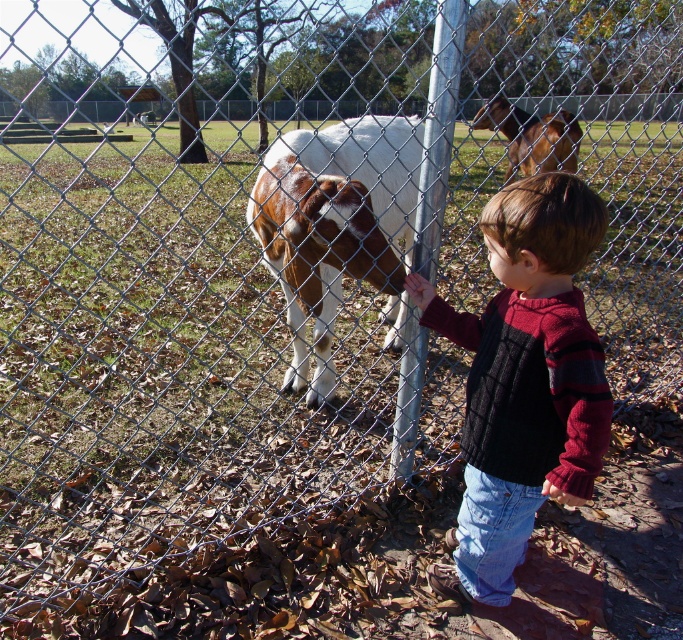
You are a photographer trying to capture the calf in the center. The camera you are using has a focus point at position (337, 227). Based on the scene, what is the camera focusing on?

A: The point (337, 227) is on the brown and white fur at center, so the camera is focusing on the calf.

You are a photographer trying to capture a clear shot of both the knitted sweater at center and the brown and white fur at center. Based on their positions, which object should you focus on first to ensure both are in focus?

The knitted sweater at center is below brown and white fur at center, so you should focus on the brown and white fur at center first to ensure both are in focus.

You are a photographer trying to capture a clear shot of the brown glossy horse at upper center. However, the knitted sweater at center is blocking your view. Can you determine if the horse is visible from your current position?

The knitted sweater at center is in front of the brown glossy horse at upper center, so the horse is partially or fully blocked from view. Move to a position where the sweater is no longer between you and the horse to get a clear shot.